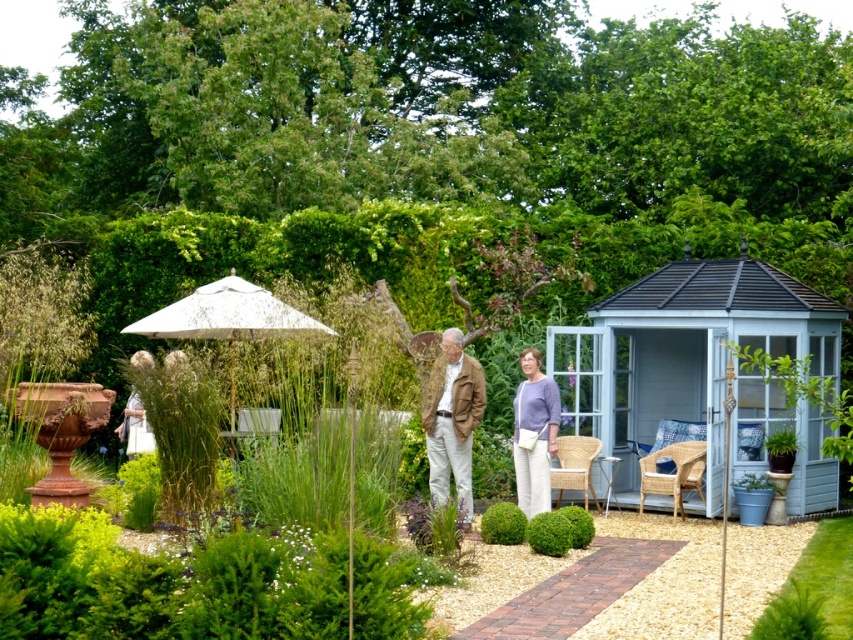
Between point (242, 339) and point (581, 524), which one is positioned behind?

Point (242, 339)

In the scene shown: Is white fabric umbrella at center shorter than green textured ball at center?

Incorrect, white fabric umbrella at center's height does not fall short of green textured ball at center's.

At what (x,y) coordinates should I click in order to perform the action: click on white fabric umbrella at center. Please return your answer as a coordinate pair (x, y). The width and height of the screenshot is (853, 640). Looking at the image, I should click on (228, 320).

Between white fabric umbrella at center and green leafy plant at lower right, which one is positioned higher?

white fabric umbrella at center

Between white fabric umbrella at center and green leafy plant at lower right, which one appears on the left side from the viewer's perspective?

white fabric umbrella at center is more to the left.

Where is `white fabric umbrella at center`? The height and width of the screenshot is (640, 853). white fabric umbrella at center is located at coordinates (228, 320).

How far apart are light blue wooden gazebo at right and white fabric umbrella at center?

light blue wooden gazebo at right is 4.90 meters from white fabric umbrella at center.

Is light blue wooden gazebo at right bigger than white fabric umbrella at center?

Yes, light blue wooden gazebo at right is bigger than white fabric umbrella at center.

Is point (773, 268) more distant than point (229, 326)?

Yes.

The height and width of the screenshot is (640, 853). I want to click on light blue wooden gazebo at right, so click(x=682, y=353).